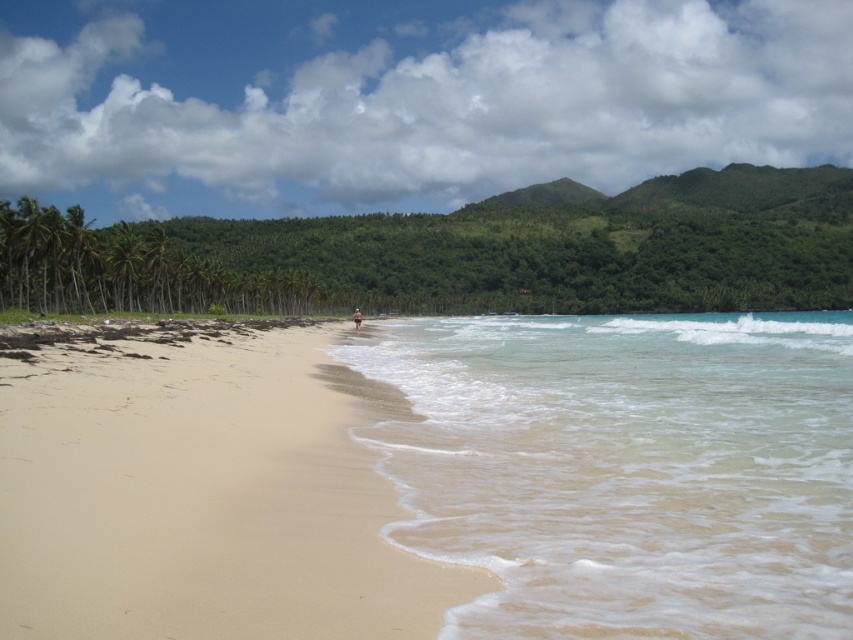
Between clear water at lower right and sandy beach at lower left, which one appears on the right side from the viewer's perspective?

clear water at lower right

Is point (819, 417) positioned before point (303, 390)?

Yes, it is in front of point (303, 390).

Which is in front, point (769, 458) or point (393, 589)?

Point (393, 589) is in front.

What are the coordinates of `clear water at lower right` in the screenshot? It's located at [625, 468].

From the picture: Is clear water at lower right positioned at the back of green leafy palm tree at left?

No, clear water at lower right is in front of green leafy palm tree at left.

Is point (711, 474) in front of point (83, 225)?

Yes.

This screenshot has width=853, height=640. I want to click on clear water at lower right, so click(x=625, y=468).

Which of these two, sandy beach at lower left or green leafy palm tree at left, stands shorter?

sandy beach at lower left

Does sandy beach at lower left have a greater width compared to green leafy palm tree at left?

Yes.

Between point (341, 620) and point (84, 252), which one is positioned in front?

Positioned in front is point (341, 620).

Image resolution: width=853 pixels, height=640 pixels. Identify the location of sandy beach at lower left. (202, 499).